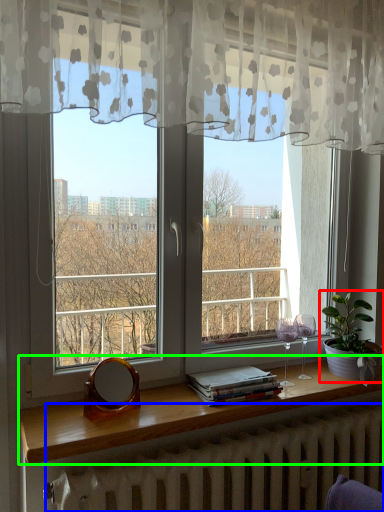
Question: Estimate the real-world distances between objects in this image. Which object is farther from houseplant (highlighted by a red box), radiator (highlighted by a blue box) or window sill (highlighted by a green box)?

Choices:
 (A) radiator
 (B) window sill

Answer: (A)